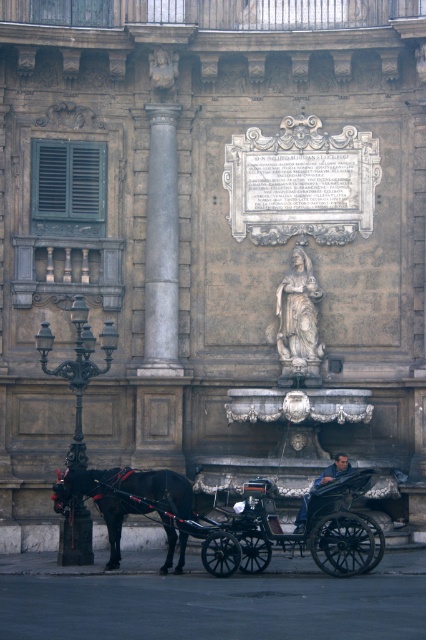
You are a tourist standing in front of the grand building and see the shiny black horse at left and the blue denim jeans at lower center. Which object is located more to the left?

The shiny black horse at left is positioned on the left side of blue denim jeans at lower center, so it is more to the left.

You are standing in front of the grand building and want to take a photo. There are two points marked on the building facade, one at point coordinates point (x=112, y=534) and the other at point coordinates point (x=342, y=461). Which point will appear larger in your camera view?

Point (x=112, y=534) is closer to the camera than point (x=342, y=461), so it will appear larger in the camera view.

Based on the scene description, where is the polished stone column at center located in terms of coordinates?

The polished stone column at center is located at coordinates point (x=161, y=246).